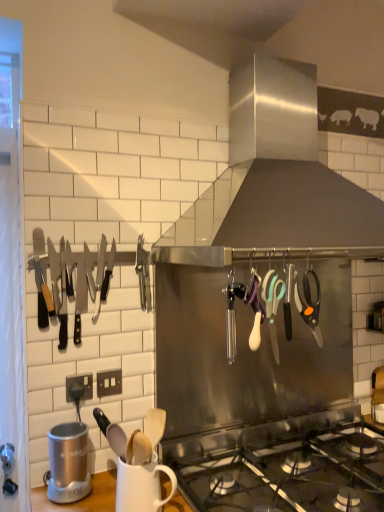
Question: Can you confirm if silver metallic blender at lower left is positioned to the right of white matte mug at lower center?

Choices:
 (A) no
 (B) yes

Answer: (A)

Question: Is silver metallic blender at lower left positioned behind white matte mug at lower center?

Choices:
 (A) no
 (B) yes

Answer: (B)

Question: Considering the relative positions of silver metallic blender at lower left and white matte mug at lower center in the image provided, is silver metallic blender at lower left to the left of white matte mug at lower center from the viewer's perspective?

Choices:
 (A) no
 (B) yes

Answer: (B)

Question: Does silver metallic blender at lower left have a greater width compared to white matte mug at lower center?

Choices:
 (A) no
 (B) yes

Answer: (A)

Question: Is silver metallic blender at lower left shorter than white matte mug at lower center?

Choices:
 (A) yes
 (B) no

Answer: (B)

Question: From the image's perspective, is stainless steel knives at left located above or below white matte mug at lower center?

Choices:
 (A) above
 (B) below

Answer: (A)

Question: Is stainless steel knives at left bigger or smaller than white matte mug at lower center?

Choices:
 (A) small
 (B) big

Answer: (B)

Question: Does point (79, 263) appear closer or farther from the camera than point (147, 475)?

Choices:
 (A) closer
 (B) farther

Answer: (B)

Question: Is stainless steel knives at left in front of or behind white matte mug at lower center in the image?

Choices:
 (A) behind
 (B) front

Answer: (A)

Question: Considering their positions, is orange-handled scissors at center-right, positioned as the first scissors in right-to-left order, located in front of or behind stainless steel knives at left?

Choices:
 (A) behind
 (B) front

Answer: (B)

Question: From a real-world perspective, is orange-handled scissors at center-right, the 2th scissors viewed from the left, above or below stainless steel knives at left?

Choices:
 (A) above
 (B) below

Answer: (B)

Question: Which is correct: orange-handled scissors at center-right, the 2th scissors viewed from the left, is inside stainless steel knives at left, or outside of it?

Choices:
 (A) outside
 (B) inside

Answer: (A)

Question: Is point (309, 311) positioned closer to the camera than point (34, 265)?

Choices:
 (A) closer
 (B) farther

Answer: (A)

Question: Relative to stainless steel range hood at upper center, is stainless steel knives at left in front or behind?

Choices:
 (A) behind
 (B) front

Answer: (A)

Question: Is stainless steel knives at left taller or shorter than stainless steel range hood at upper center?

Choices:
 (A) tall
 (B) short

Answer: (B)